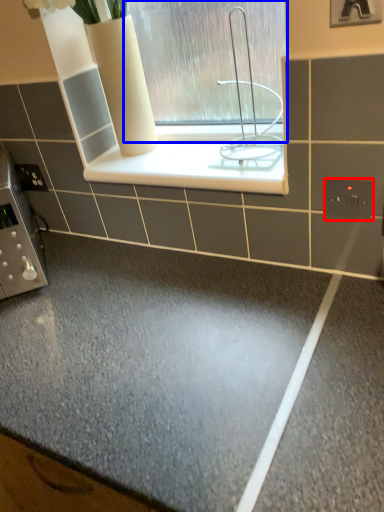
Question: Among these objects, which one is nearest to the camera, electric outlet (highlighted by a red box) or window (highlighted by a blue box)?

Choices:
 (A) electric outlet
 (B) window

Answer: (B)